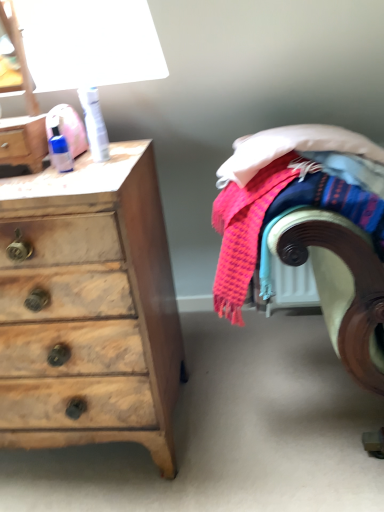
The height and width of the screenshot is (512, 384). In order to click on free area behind blue plastic bottle at upper left, marked as the 1th toiletry in a left-to-right arrangement in this screenshot , I will do `click(89, 156)`.